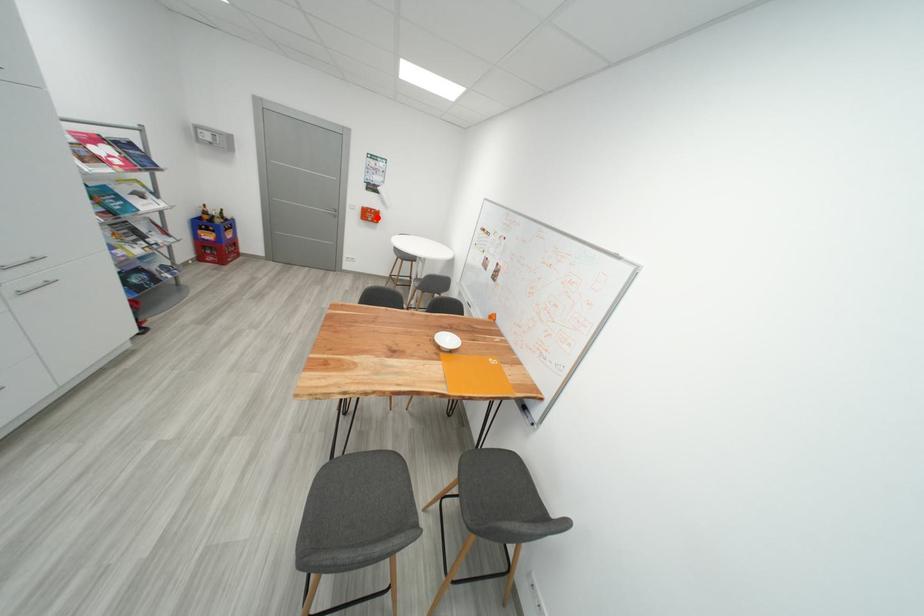
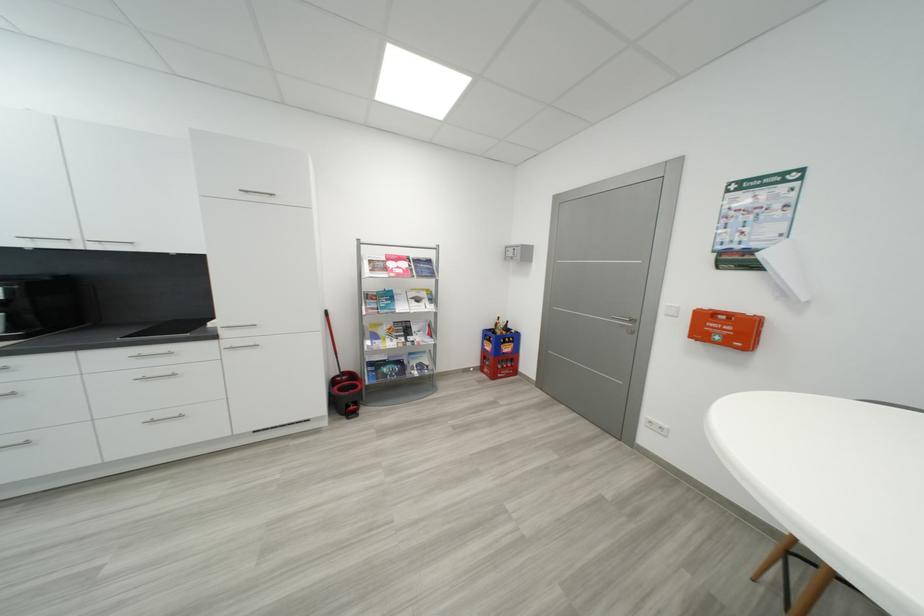
In the second image, find the point that corresponds to the highlighted location in the first image.

(733, 333)